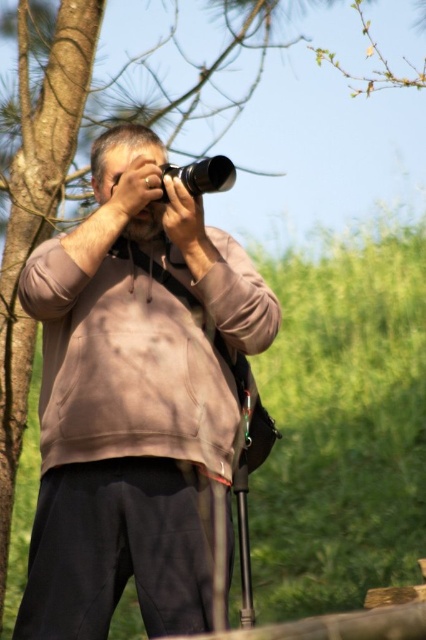
Does brown cotton hoodie at center have a greater width compared to metallic silver camera at center?

Yes.

Is brown cotton hoodie at center further to the viewer compared to metallic silver camera at center?

That is True.

Which is behind, point (69, 460) or point (210, 168)?

The point (69, 460) is behind.

Find the location of a particular element. Image resolution: width=426 pixels, height=640 pixels. brown cotton hoodie at center is located at coordinates (140, 403).